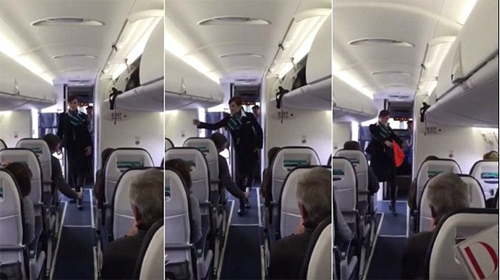
Locate an element on the screen. Image resolution: width=500 pixels, height=280 pixels. floor is located at coordinates (245, 250), (70, 237), (388, 253).